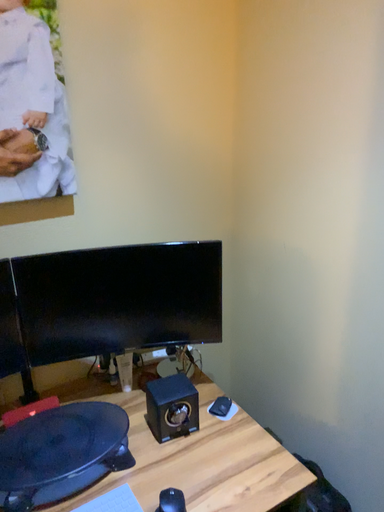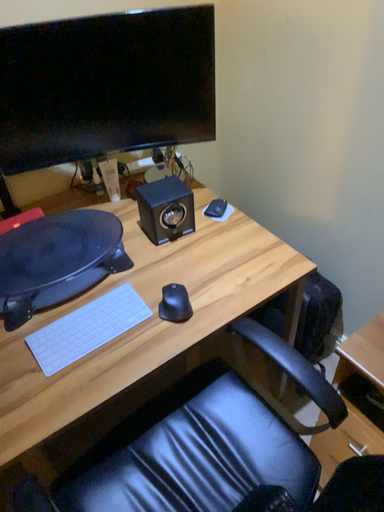
Question: Which way did the camera rotate in the video?

Choices:
 (A) rotated upward
 (B) rotated downward

Answer: (B)